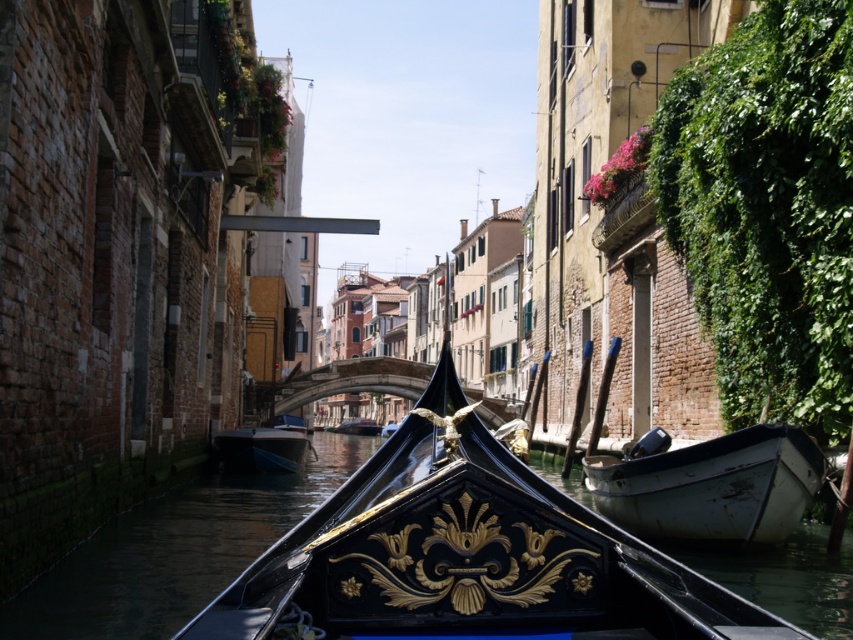
You are a tourist standing on the bridge overlooking the canal. You see a blue glossy boat at center and a black polished wood boat at center. If you want to take a photo that includes both boats in the same frame, would their current distance apart allow for that?

The distance between the blue glossy boat at center and the black polished wood boat at center is 180.79 meters, which is too far to capture both in a single photo frame from your current position on the bridge.

From the picture: You are standing on a bridge overlooking the canal. You see a point at coordinates point (467, 556). Which object is this point located on?

The point (467, 556) is located on the black polished wood gondola at center.